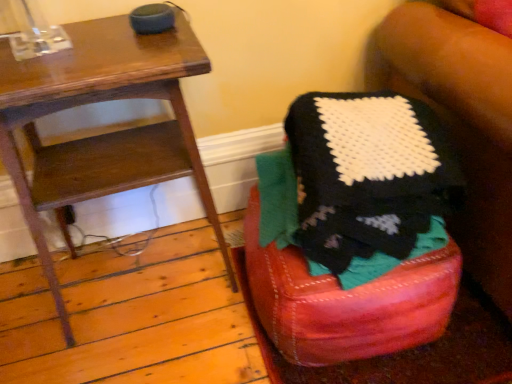
Describe the element at coordinates (104, 134) in the screenshot. I see `wooden side table at left` at that location.

This screenshot has height=384, width=512. In order to click on wooden side table at left in this screenshot , I will do `click(104, 134)`.

What are the coordinates of `knitted fabric stool at lower right` in the screenshot? It's located at (346, 302).

What do you see at coordinates (346, 302) in the screenshot? This screenshot has height=384, width=512. I see `knitted fabric stool at lower right` at bounding box center [346, 302].

What is the approximate width of knitted fabric stool at lower right?

knitted fabric stool at lower right is 20.49 inches wide.

In order to click on wooden side table at left in this screenshot , I will do `click(104, 134)`.

Is knitted fabric stool at lower right at the right side of wooden side table at left?

Yes.

Is knitted fabric stool at lower right further to the viewer compared to wooden side table at left?

Yes.

Does point (331, 329) appear closer or farther from the camera than point (23, 104)?

Clearly, point (331, 329) is more distant from the camera than point (23, 104).

From the image's perspective, is knitted fabric stool at lower right positioned above or below wooden side table at left?

Clearly, from the image's perspective, knitted fabric stool at lower right is below wooden side table at left.

From a real-world perspective, which object stands above the other?

wooden side table at left.

Is knitted fabric stool at lower right wider than wooden side table at left?

Yes, knitted fabric stool at lower right is wider than wooden side table at left.

Considering the sizes of objects knitted fabric stool at lower right and wooden side table at left in the image provided, who is shorter, knitted fabric stool at lower right or wooden side table at left?

Standing shorter between the two is knitted fabric stool at lower right.

Which of these two, knitted fabric stool at lower right or wooden side table at left, is smaller?

knitted fabric stool at lower right is smaller.

Is wooden side table at left surrounded by knitted fabric stool at lower right?

Actually, wooden side table at left is outside knitted fabric stool at lower right.

Is knitted fabric stool at lower right touching wooden side table at left?

knitted fabric stool at lower right and wooden side table at left are not in contact.

Is knitted fabric stool at lower right facing towards wooden side table at left?

No, knitted fabric stool at lower right is not turned towards wooden side table at left.

What's the angular difference between knitted fabric stool at lower right and wooden side table at left's facing directions?

The facing directions of knitted fabric stool at lower right and wooden side table at left are 0.627 degrees apart.

Identify the location of furniture in front of the knitted fabric stool at lower right. (x=104, y=134).

Based on their positions, is wooden side table at left located to the left or right of knitted fabric stool at lower right?

wooden side table at left is to the left of knitted fabric stool at lower right.

Is the depth of wooden side table at left greater than that of knitted fabric stool at lower right?

No, it is not.

Which is closer, [36,214] or [270,245]?

The point [36,214] is more forward.

From the image's perspective, which object appears higher, wooden side table at left or knitted fabric stool at lower right?

wooden side table at left, from the image's perspective.

From a real-world perspective, who is located lower, wooden side table at left or knitted fabric stool at lower right?

In real-world perspective, knitted fabric stool at lower right is lower.

In terms of width, does wooden side table at left look wider or thinner when compared to knitted fabric stool at lower right?

In the image, wooden side table at left appears to be more narrow than knitted fabric stool at lower right.

Can you confirm if wooden side table at left is shorter than knitted fabric stool at lower right?

Incorrect, the height of wooden side table at left does not fall short of that of knitted fabric stool at lower right.

Between wooden side table at left and knitted fabric stool at lower right, which one has smaller size?

knitted fabric stool at lower right.

Is wooden side table at left situated inside knitted fabric stool at lower right or outside?

wooden side table at left cannot be found inside knitted fabric stool at lower right.

Is wooden side table at left beside knitted fabric stool at lower right?

No, wooden side table at left is not making contact with knitted fabric stool at lower right.

Consider the image. Could you tell me if wooden side table at left is turned towards knitted fabric stool at lower right?

No, wooden side table at left is not oriented towards knitted fabric stool at lower right.

Can you tell me how much wooden side table at left and knitted fabric stool at lower right differ in facing direction?

0.627 degrees.

How far apart are wooden side table at left and knitted fabric stool at lower right?

wooden side table at left and knitted fabric stool at lower right are 16.84 inches apart.

Where is `bar stool below the wooden side table at left (from the image's perspective)`? The height and width of the screenshot is (384, 512). bar stool below the wooden side table at left (from the image's perspective) is located at coordinates (346, 302).

You are a GUI agent. You are given a task and a screenshot of the screen. Output one action in this format:
    pyautogui.click(x=<x>, y=<y>)
    Task: Click on the bar stool below the wooden side table at left (from a real-world perspective)
    This screenshot has width=512, height=384.
    Given the screenshot: What is the action you would take?
    pyautogui.click(x=346, y=302)

There is a knitted fabric stool at lower right. At what (x,y) coordinates should I click in order to perform the action: click on furniture above it (from a real-world perspective). Please return your answer as a coordinate pair (x, y). This screenshot has height=384, width=512. Looking at the image, I should click on pyautogui.click(x=104, y=134).